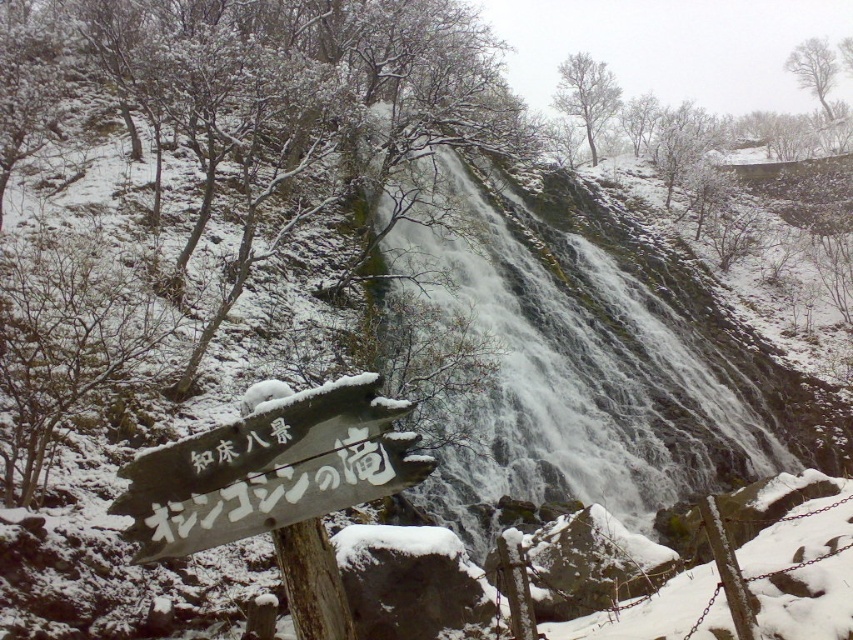
Does point (454, 248) lie in front of point (306, 488)?

No, it is not.

Can you confirm if white frothy water at center is bigger than white wooden sign at lower left?

Indeed, white frothy water at center has a larger size compared to white wooden sign at lower left.

Who is more distant from viewer, (697,385) or (347,413)?

Positioned behind is point (697,385).

Where is `white frothy water at center`? The height and width of the screenshot is (640, 853). white frothy water at center is located at coordinates (569, 371).